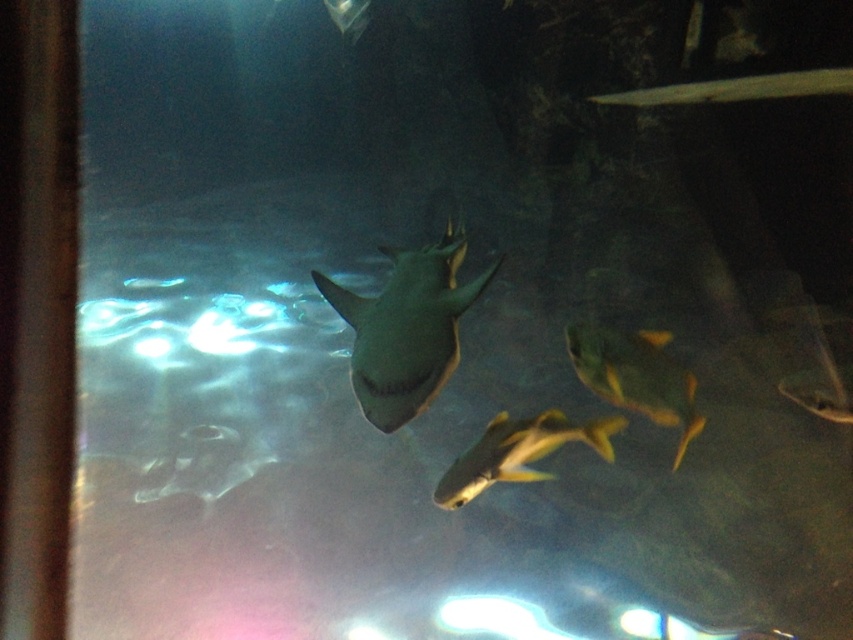
Question: Considering the real-world distances, which object is closest to the yellow matte fish at center?

Choices:
 (A) shiny yellow fish at center
 (B) matte gray shark at upper center
 (C) shiny gray shark at center

Answer: (A)

Question: Does shiny gray shark at center lie in front of shiny yellow fish at center?

Choices:
 (A) no
 (B) yes

Answer: (B)

Question: Which point is closer to the camera?

Choices:
 (A) shiny gray shark at center
 (B) shiny yellow fish at center
 (C) yellow matte fish at center

Answer: (A)

Question: Does yellow matte fish at center have a lesser width compared to matte gray shark at upper center?

Choices:
 (A) yes
 (B) no

Answer: (B)

Question: Can you confirm if shiny gray shark at center is thinner than matte gray shark at upper center?

Choices:
 (A) yes
 (B) no

Answer: (B)

Question: Which point is farther to the camera?

Choices:
 (A) (589, 353)
 (B) (363, 0)
 (C) (461, 486)

Answer: (B)